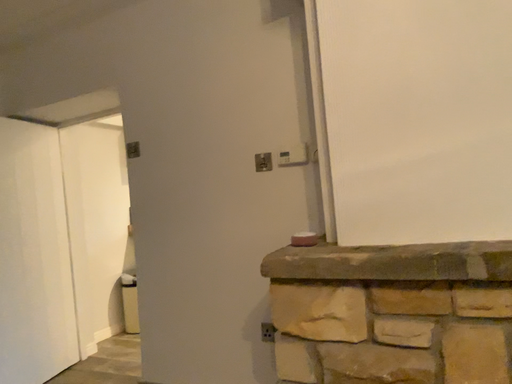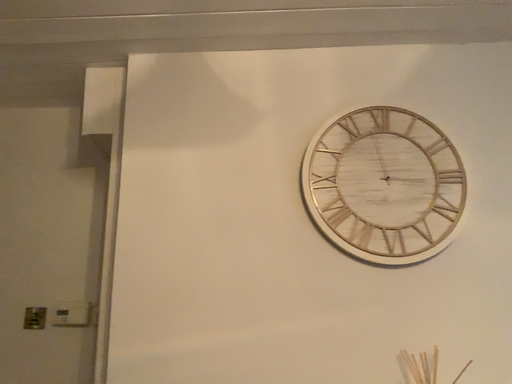
Question: How did the camera likely rotate when shooting the video?

Choices:
 (A) rotated left
 (B) rotated right

Answer: (B)